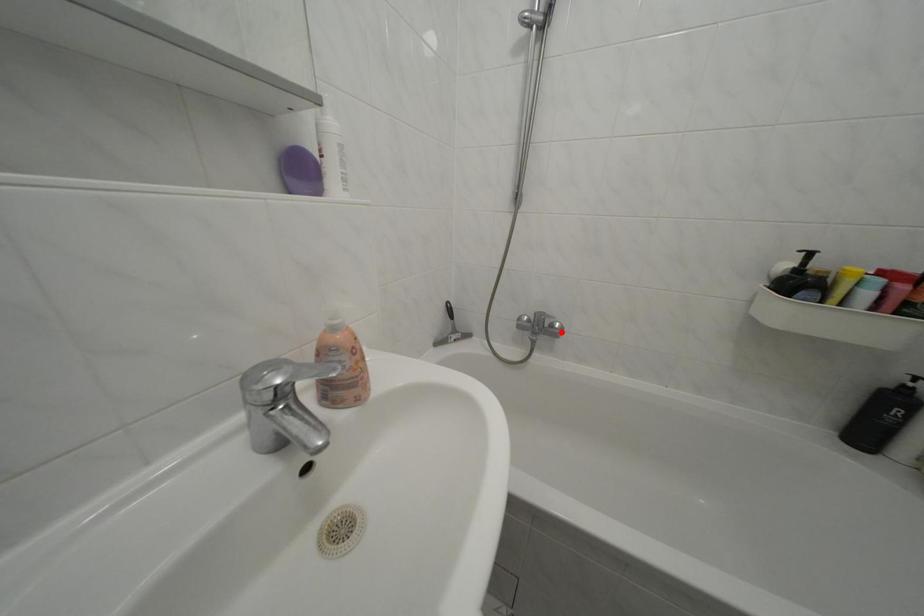
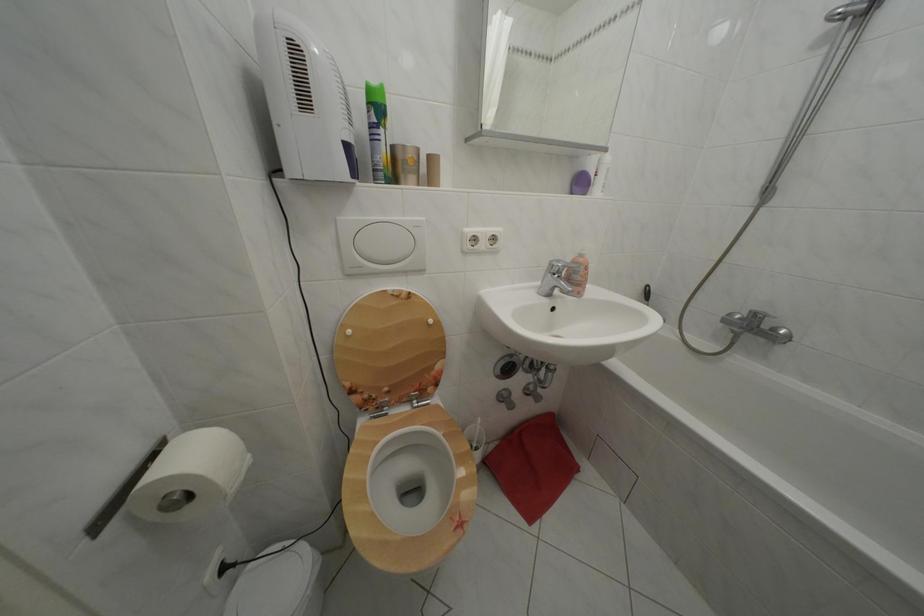
Where in the second image is the point corresponding to the highlighted location from the first image?

(783, 336)